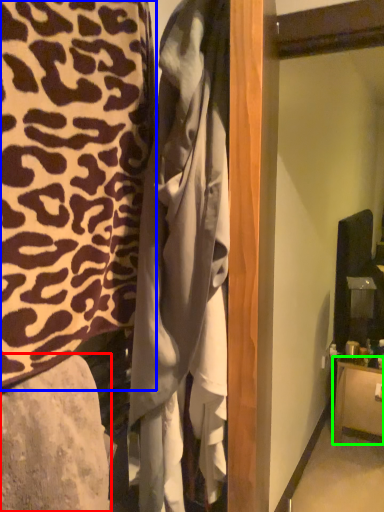
Question: Estimate the real-world distances between objects in this image. Which object is closer to furniture (highlighted by a red box), furniture (highlighted by a blue box) or furniture (highlighted by a green box)?

Choices:
 (A) furniture
 (B) furniture

Answer: (A)